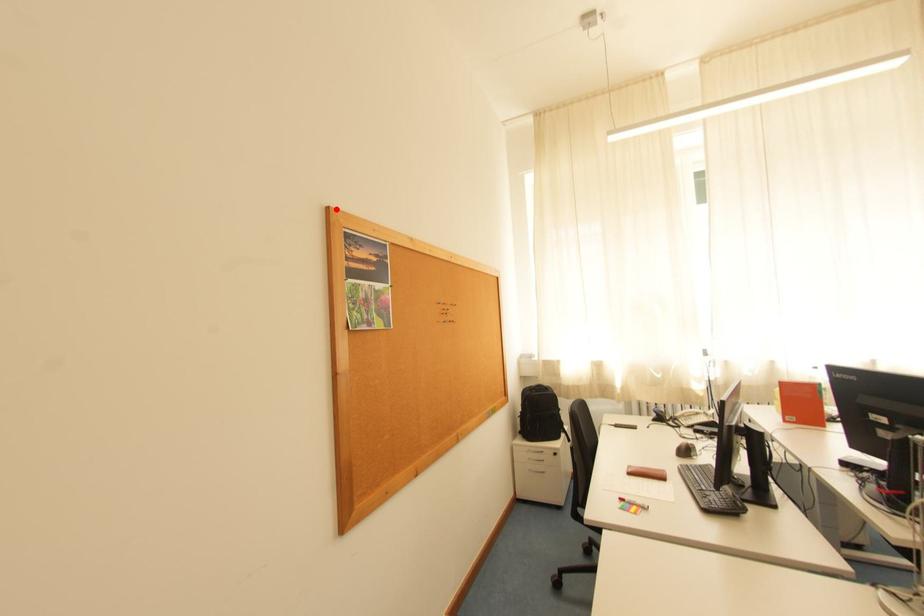
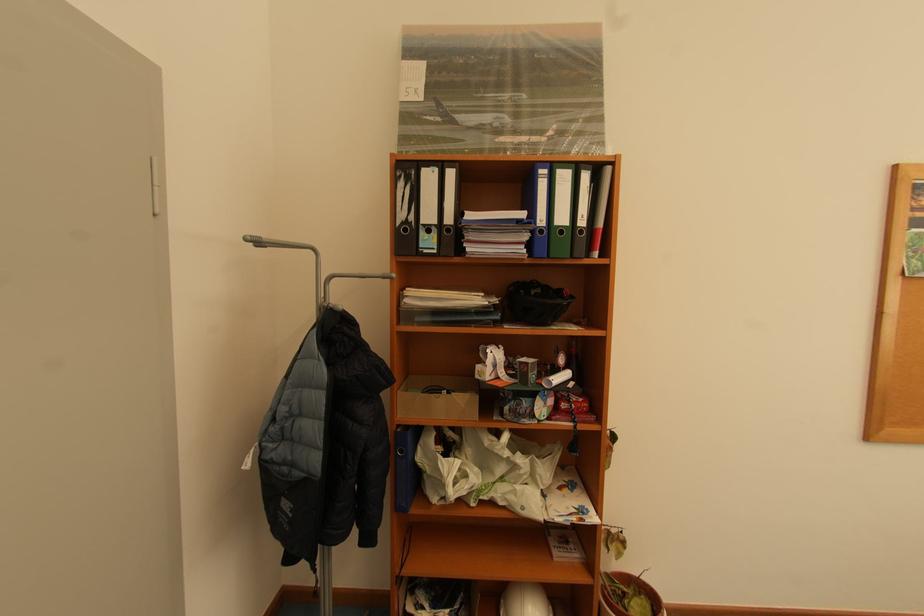
In the second image, find the point that corresponds to the highlighted location in the first image.

(904, 167)